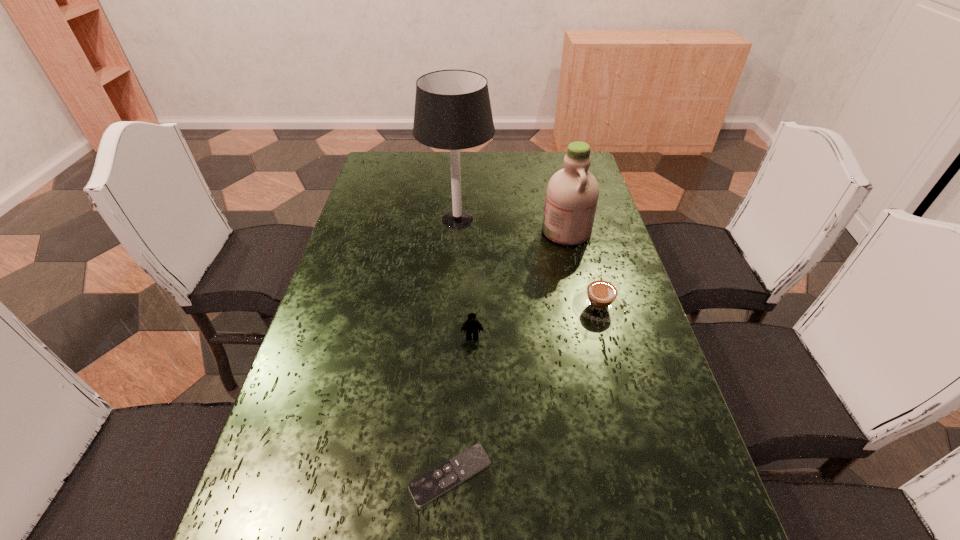
This screenshot has height=540, width=960. I want to click on blank space located 0.250m on the face of the fourth farthest object, so click(470, 439).

This screenshot has width=960, height=540. In order to click on free location located 0.170m on the back of the third farthest object in this screenshot , I will do `click(583, 248)`.

Where is `free spot located 0.260m on the back of the nearest object`? The width and height of the screenshot is (960, 540). free spot located 0.260m on the back of the nearest object is located at coordinates (457, 341).

Find the location of a particular element. This screenshot has width=960, height=540. cleansing agent at the right edge is located at coordinates (572, 193).

Locate an element on the screen. cappuccino that is at the right edge is located at coordinates (599, 300).

The width and height of the screenshot is (960, 540). What are the coordinates of `vacant space at the far edge` in the screenshot? It's located at (525, 183).

I want to click on free location at the left edge of the desktop, so click(321, 403).

This screenshot has height=540, width=960. I want to click on free spot at the right edge of the desktop, so click(651, 437).

The height and width of the screenshot is (540, 960). I want to click on vacant region at the far left corner, so click(391, 175).

The image size is (960, 540). I want to click on free spot between the tallest object and the third nearest object, so click(x=528, y=262).